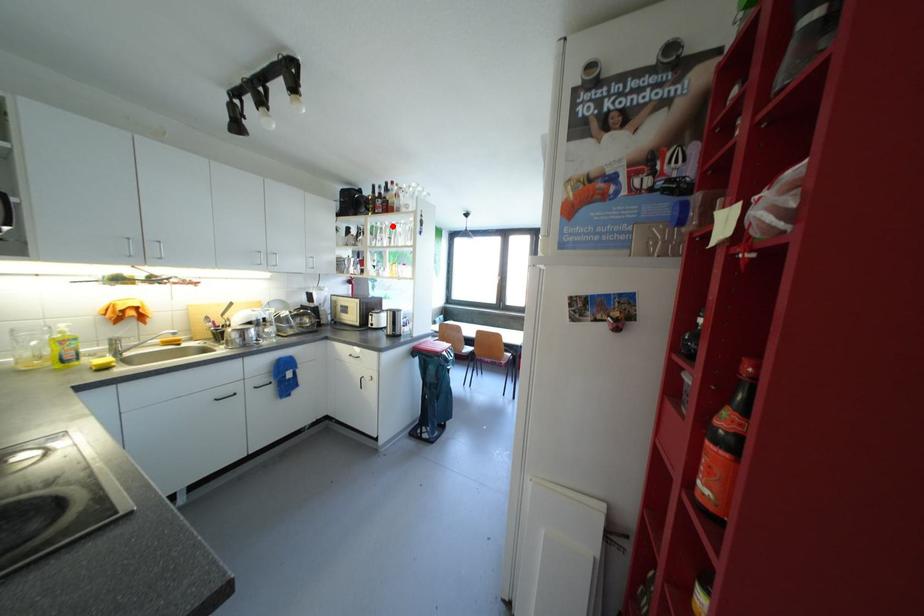
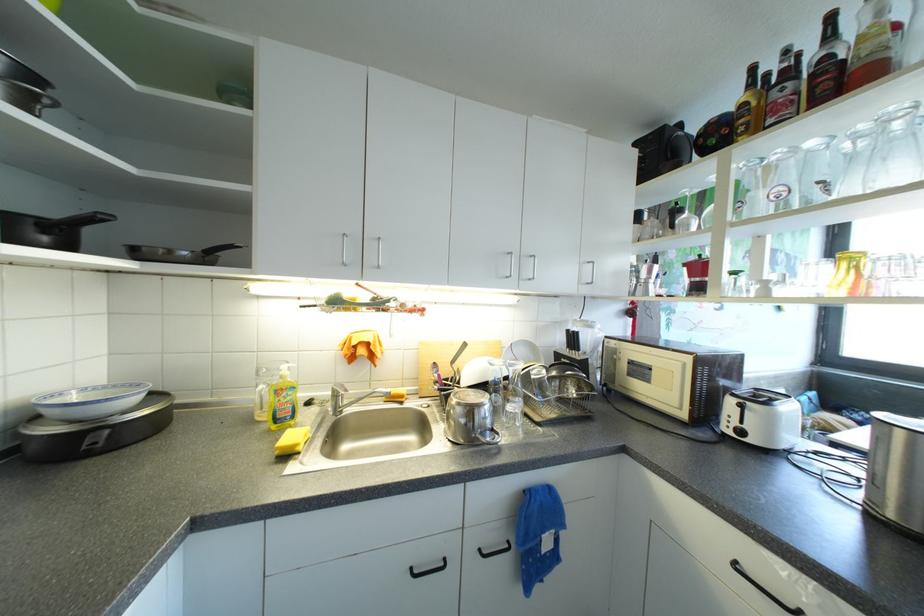
Where in the second image is the point corresponding to the highlighted location from the first image?

(818, 146)